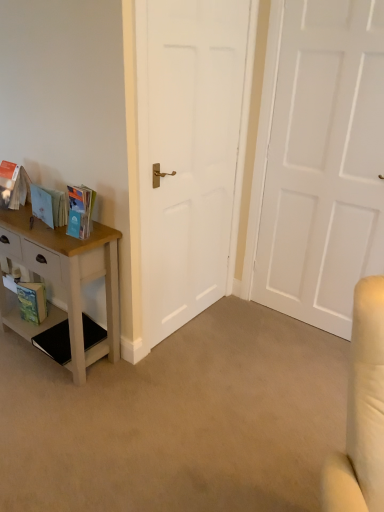
At what (x,y) coordinates should I click in order to perform the action: click on vacant area that is in front of white matte door at center, which appears as the second door when viewed from the right. Please return your answer as a coordinate pair (x, y). This screenshot has height=512, width=384. Looking at the image, I should click on (191, 369).